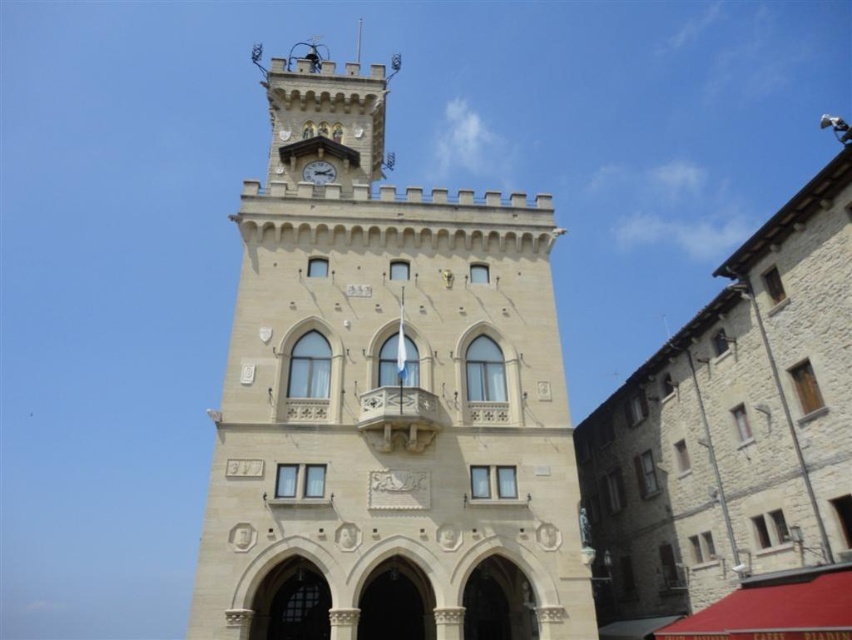
Question: Which point is farther to the camera?

Choices:
 (A) metallic clock at center
 (B) beige stone clock tower at center

Answer: (A)

Question: In this image, where is beige stone clock tower at center located relative to metallic clock at center?

Choices:
 (A) below
 (B) above

Answer: (B)

Question: Does beige stone clock tower at center have a larger size compared to metallic clock at center?

Choices:
 (A) yes
 (B) no

Answer: (A)

Question: Does beige stone clock tower at center appear under metallic clock at center?

Choices:
 (A) yes
 (B) no

Answer: (B)